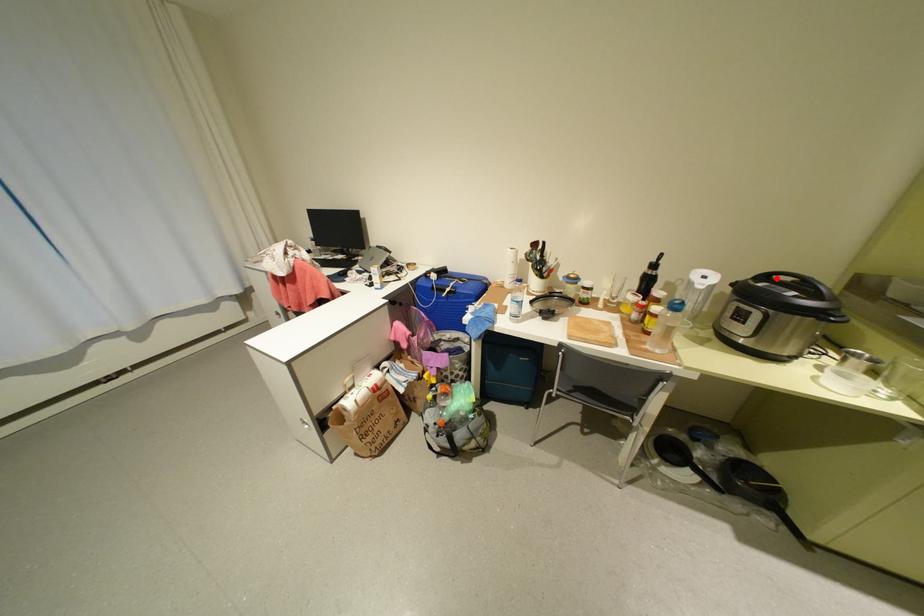
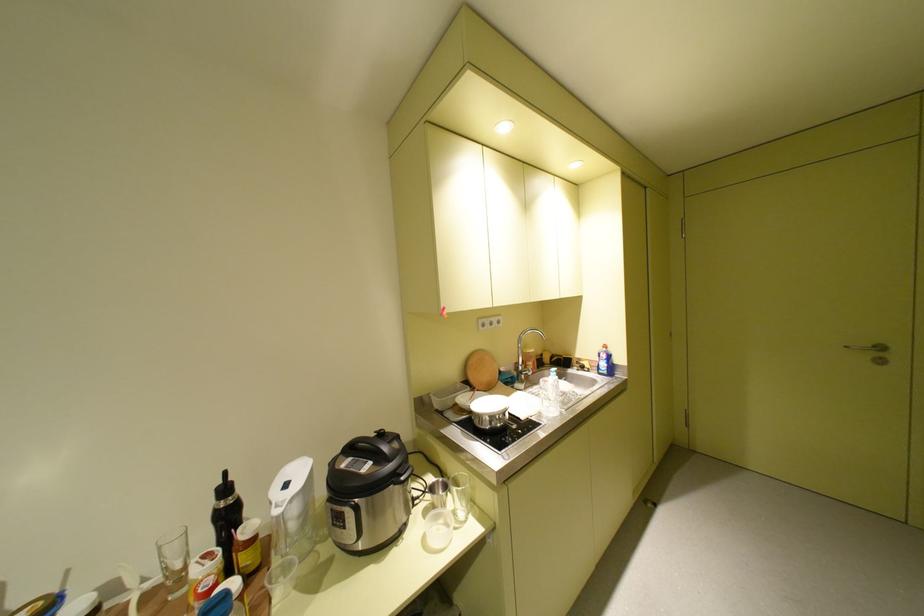
The point at the highlighted location is marked in the first image. Where is the corresponding point in the second image?

(361, 448)